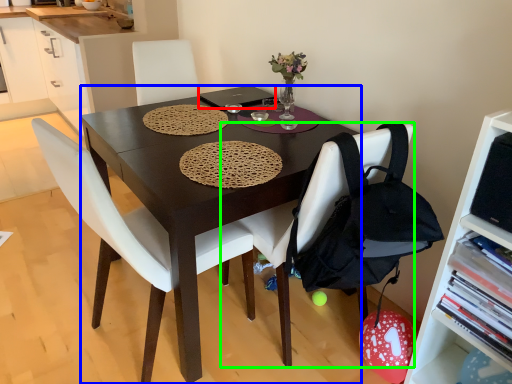
Question: Estimate the real-world distances between objects in this image. Which object is farther from laptop (highlighted by a red box), desk (highlighted by a blue box) or chair (highlighted by a green box)?

Choices:
 (A) desk
 (B) chair

Answer: (B)